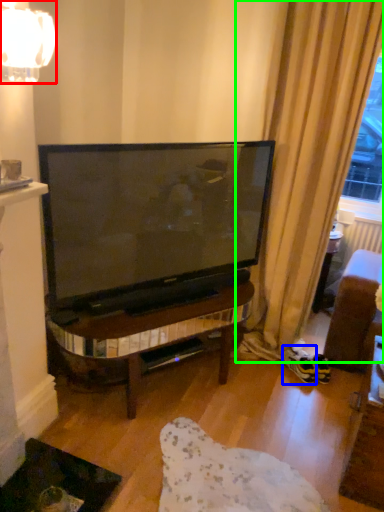
Question: Which object is positioned closest to lamp (highlighted by a red box)? Select from footwear (highlighted by a blue box) and curtain (highlighted by a green box).

Choices:
 (A) footwear
 (B) curtain

Answer: (B)